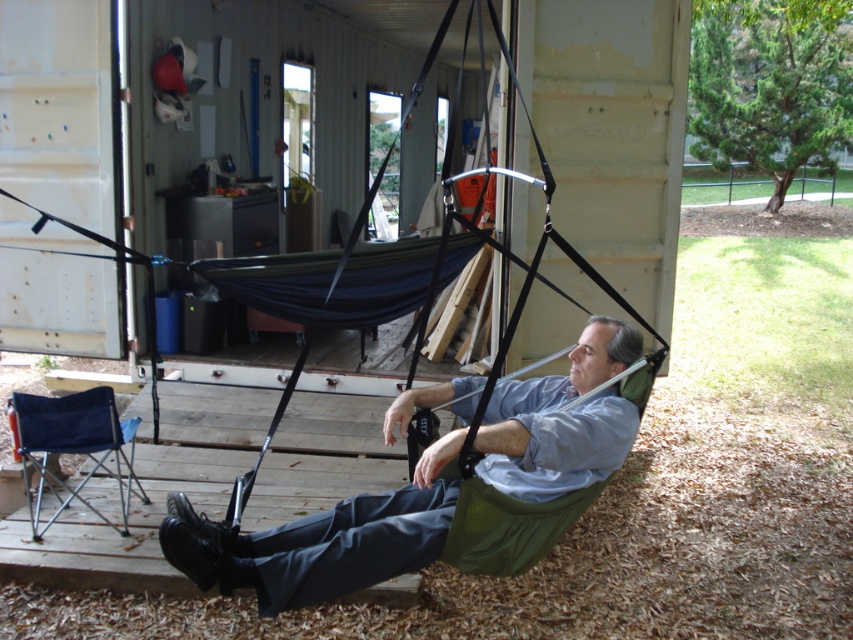
You are planning to hang a new plant hanger in the area. The plant hanger requires a minimum height of 2 meters to be safely hung. Based on the scene, can you determine if the green fabric hammock at center or the blue fabric folding chair at lower left has sufficient height for the plant hanger?

The green fabric hammock at center is much taller than the blue fabric folding chair at lower left. Therefore, the green fabric hammock at center likely has sufficient height for the plant hanger, while the blue fabric folding chair at lower left may not meet the 2 meter requirement.

You are planning to take a nap in the most spacious seating option available in this outdoor area. Which one should you choose between the green fabric hammock at center and the blue fabric folding chair at lower left?

The green fabric hammock at center has a larger size compared to the blue fabric folding chair at lower left, so you should choose the green fabric hammock at center for a more spacious nap.